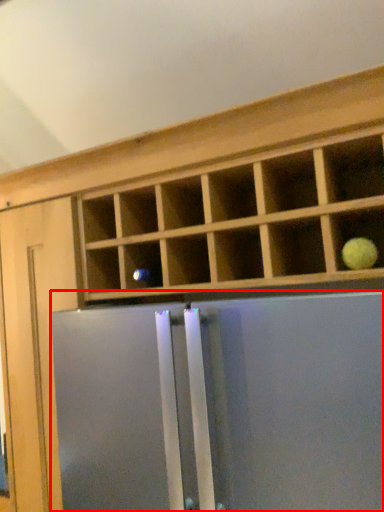
Question: Observing the image, what is the correct spatial positioning of screen door (annotated by the red box) in reference to fruit?

Choices:
 (A) left
 (B) right

Answer: (A)